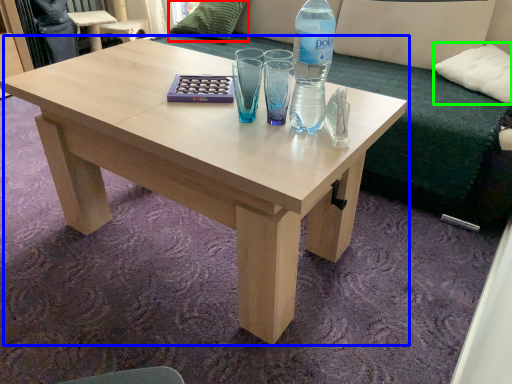
Question: Which object is the closest to the pillow (highlighted by a red box)? Choose among these: coffee table (highlighted by a blue box) or pillow (highlighted by a green box).

Choices:
 (A) coffee table
 (B) pillow

Answer: (A)